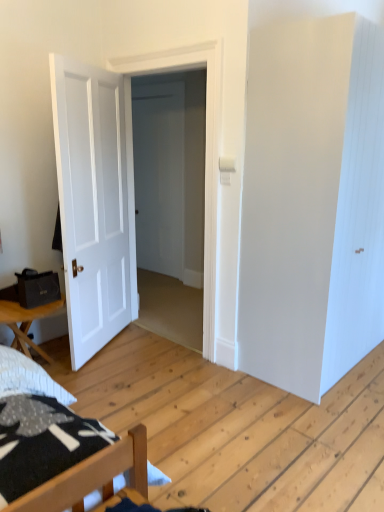
Question: Considering the relative positions of white matte door at left, arranged as the second door when viewed from the right, and wooden table at lower left in the image provided, is white matte door at left, arranged as the second door when viewed from the right, to the left of wooden table at lower left from the viewer's perspective?

Choices:
 (A) no
 (B) yes

Answer: (A)

Question: Is wooden table at lower left at the back of white matte door at left, which appears as the first door when viewed from the left?

Choices:
 (A) yes
 (B) no

Answer: (B)

Question: Can you confirm if white matte door at left, arranged as the second door when viewed from the right, is shorter than wooden table at lower left?

Choices:
 (A) yes
 (B) no

Answer: (B)

Question: Does white matte door at left, which appears as the first door when viewed from the left, contain wooden table at lower left?

Choices:
 (A) no
 (B) yes

Answer: (A)

Question: Does white matte door at left, which appears as the first door when viewed from the left, come in front of wooden table at lower left?

Choices:
 (A) no
 (B) yes

Answer: (B)

Question: In the image, is wooden table at lower left positioned in front of or behind white smooth door at center, the first door when ordered from right to left?

Choices:
 (A) front
 (B) behind

Answer: (A)

Question: In terms of height, does wooden table at lower left look taller or shorter compared to white smooth door at center, the 2th door from the left?

Choices:
 (A) tall
 (B) short

Answer: (B)

Question: Is point (23, 321) positioned closer to the camera than point (132, 197)?

Choices:
 (A) farther
 (B) closer

Answer: (B)

Question: Is wooden table at lower left wider or thinner than white smooth door at center, the first door when ordered from right to left?

Choices:
 (A) wide
 (B) thin

Answer: (A)

Question: In terms of size, does white matte door at left, arranged as the second door when viewed from the right, appear bigger or smaller than white smooth door at center, the first door when ordered from right to left?

Choices:
 (A) big
 (B) small

Answer: (B)

Question: Is white matte door at left, arranged as the second door when viewed from the right, wider or thinner than white smooth door at center, the 2th door from the left?

Choices:
 (A) wide
 (B) thin

Answer: (B)

Question: From a real-world perspective, is white matte door at left, arranged as the second door when viewed from the right, physically located above or below white smooth door at center, the 2th door from the left?

Choices:
 (A) below
 (B) above

Answer: (A)

Question: From the image's perspective, is white matte door at left, which appears as the first door when viewed from the left, above or below white smooth door at center, the first door when ordered from right to left?

Choices:
 (A) above
 (B) below

Answer: (B)

Question: Considering their positions, is white smooth door at center, the 2th door from the left, located in front of or behind white matte door at left, arranged as the second door when viewed from the right?

Choices:
 (A) front
 (B) behind

Answer: (B)

Question: Do you think white smooth door at center, the 2th door from the left, is within white matte door at left, which appears as the first door when viewed from the left, or outside of it?

Choices:
 (A) outside
 (B) inside

Answer: (A)